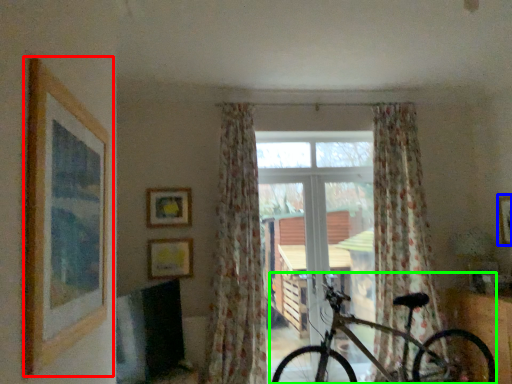
Question: Which object is the farthest from picture frame (highlighted by a red box)? Choose among these: picture frame (highlighted by a blue box) or bicycle (highlighted by a green box).

Choices:
 (A) picture frame
 (B) bicycle

Answer: (A)